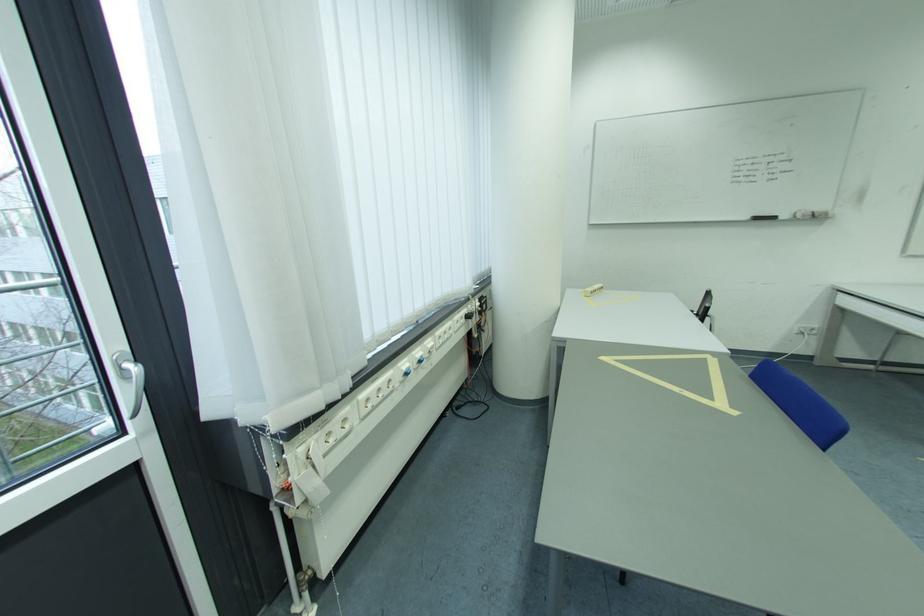
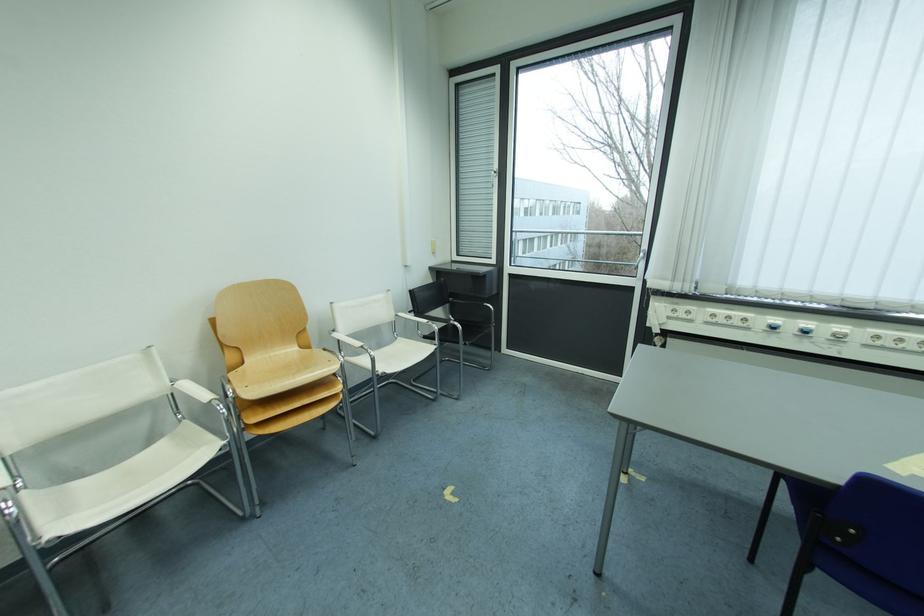
The point at (438, 344) is marked in the first image. Where is the corresponding point in the second image?

(849, 330)